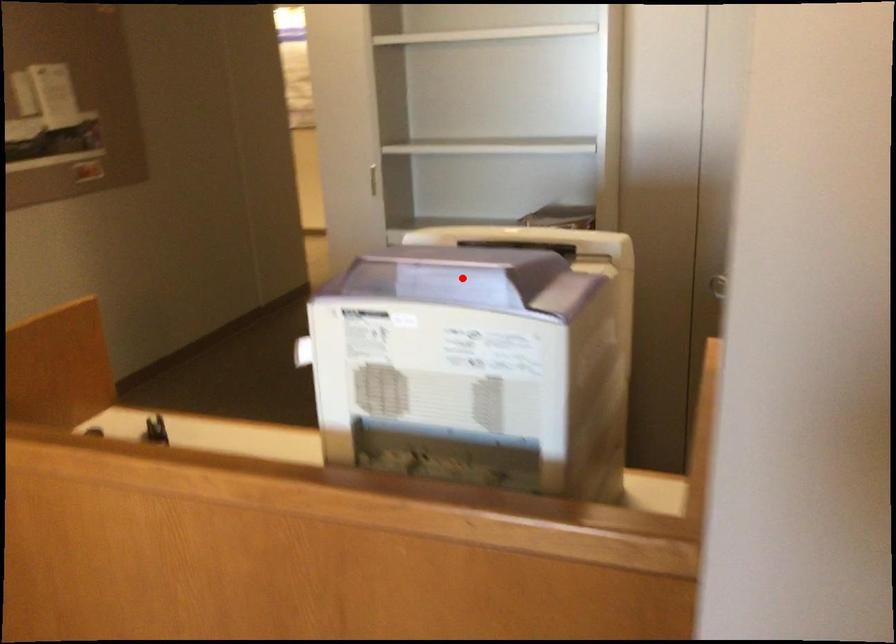
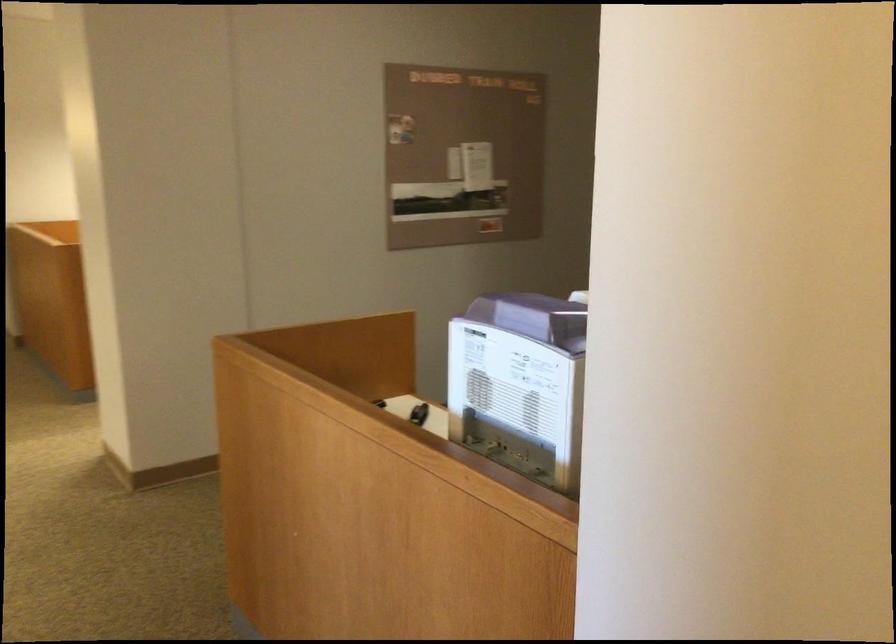
Question: I am providing you with two images of the same scene from different viewpoints. Image1 has a red point marked. In image2, the corresponding 3D location appears at what relative position? Reply with the corresponding letter.

Choices:
 (A) Closer
 (B) Farther

Answer: (B)